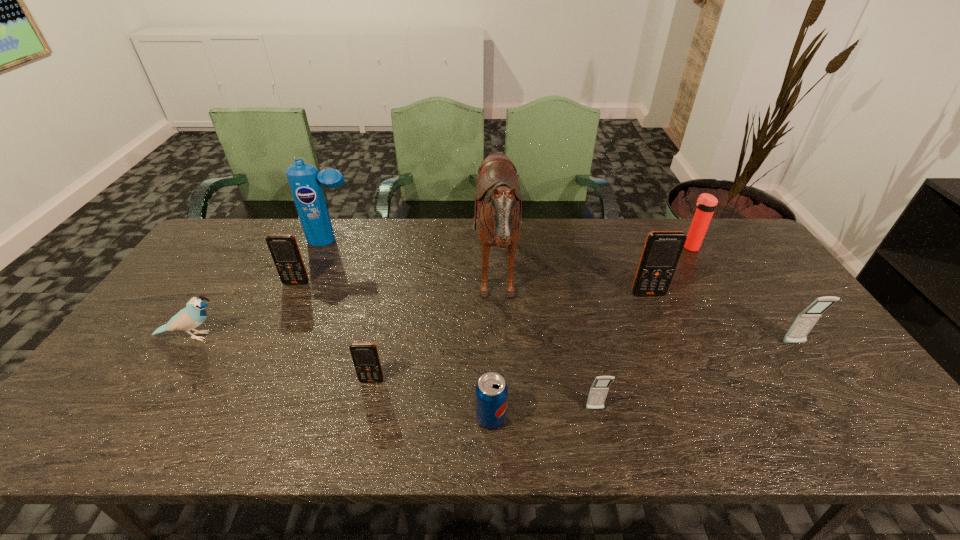
Where is `free space at the near right corner`? free space at the near right corner is located at coordinates point(852,431).

Find the location of `free space between the pop soda and the fourth nearest cellular telephone`. free space between the pop soda and the fourth nearest cellular telephone is located at coordinates (569, 356).

This screenshot has height=540, width=960. Find the location of `vacant space in between the biggest orange cellular telephone and the brown saddle`. vacant space in between the biggest orange cellular telephone and the brown saddle is located at coordinates (572, 288).

Identify the location of vacant space in between the fourth cellular telephone from left to right and the second nearest cellular telephone. The image size is (960, 540). (510, 338).

Locate an element on the screen. The height and width of the screenshot is (540, 960). free spot between the rightmost object and the ninth shortest object is located at coordinates tap(564, 292).

Where is `free spot between the biggest orange cellular telephone and the tallest object`? The height and width of the screenshot is (540, 960). free spot between the biggest orange cellular telephone and the tallest object is located at coordinates (572, 288).

You are a GUI agent. You are given a task and a screenshot of the screen. Output one action in this format:
    pyautogui.click(x=<x>, y=<y>)
    Task: Click on the vacant area between the third farthest cellular telephone and the tallest cellular telephone
    
    Given the screenshot: What is the action you would take?
    pyautogui.click(x=721, y=319)

At what (x,y) coordinates should I click in order to perform the action: click on blank region between the ninth object from left to right and the leftmost object. Please return your answer as a coordinate pair (x, y). Looking at the image, I should click on (441, 292).

This screenshot has height=540, width=960. In order to click on free space between the saddle and the farthest orange cellular telephone in this screenshot , I will do pos(396,282).

Where is `object that is the eighth nearest to the nearer gray cellular telephone`? object that is the eighth nearest to the nearer gray cellular telephone is located at coordinates (304, 180).